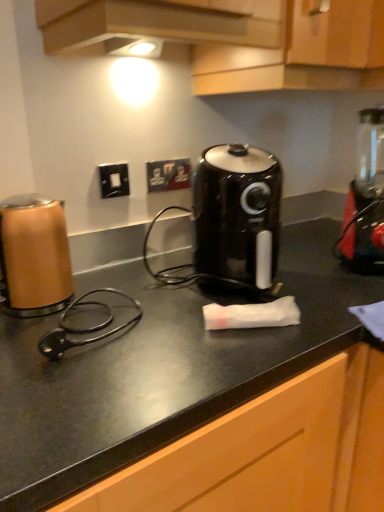
Question: Considering their positions, is copper metallic kettle at left located in front of or behind wooden cabinet at upper center?

Choices:
 (A) front
 (B) behind

Answer: (B)

Question: In terms of size, does copper metallic kettle at left appear bigger or smaller than wooden cabinet at upper center?

Choices:
 (A) big
 (B) small

Answer: (B)

Question: Which object is positioned closest to the red plastic blender at right?

Choices:
 (A) black matte countertop at center
 (B) wooden cabinet at upper center
 (C) black plastic air fryer at center
 (D) matte plastic electrical outlet at center, which is the 2th electric outlet from left to right
 (E) black plastic switch at center, marked as the first electric outlet in a front-to-back arrangement

Answer: (A)

Question: Considering the real-world distances, which object is closest to the red plastic blender at right?

Choices:
 (A) copper metallic kettle at left
 (B) matte plastic electrical outlet at center, which is the 2th electric outlet from left to right
 (C) black matte countertop at center
 (D) black plastic switch at center, which is the second electric outlet from back to front
 (E) black plastic air fryer at center

Answer: (C)